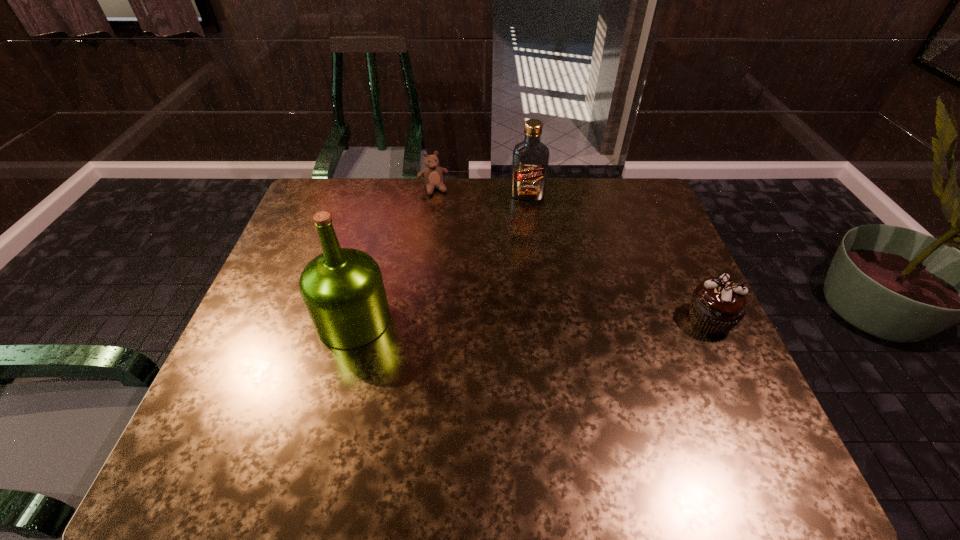
Find the location of a particular element. vacant space situated 0.280m on the front-facing side of the third object from right to left is located at coordinates (460, 250).

This screenshot has height=540, width=960. Identify the location of free region located 0.170m on the front-facing side of the third object from left to right. (525, 235).

The height and width of the screenshot is (540, 960). Find the location of `free space located on the front-facing side of the third object from left to right`. free space located on the front-facing side of the third object from left to right is located at coordinates (525, 227).

Locate an element on the screen. vacant position located on the front-facing side of the third object from left to right is located at coordinates (523, 267).

This screenshot has height=540, width=960. Find the location of `teddy bear at the far edge`. teddy bear at the far edge is located at coordinates (432, 175).

Locate an element on the screen. This screenshot has width=960, height=540. vodka located at the far edge is located at coordinates (530, 161).

The image size is (960, 540). I want to click on object present at the left edge, so click(x=343, y=291).

In order to click on object that is at the right edge in this screenshot , I will do `click(717, 305)`.

Locate an element on the screen. Image resolution: width=960 pixels, height=540 pixels. vacant space at the far edge of the desktop is located at coordinates (550, 195).

Identify the location of vacant space at the near edge of the desktop. This screenshot has width=960, height=540. (463, 408).